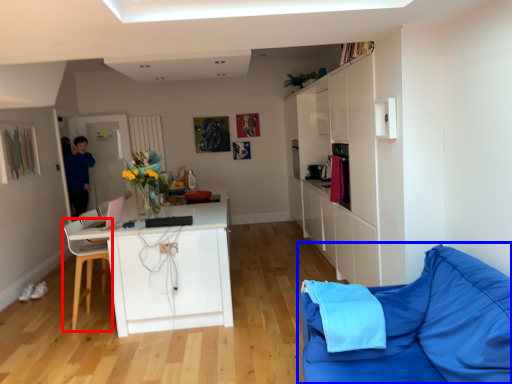
Question: Which object is closer to the camera taking this photo, chair (highlighted by a red box) or studio couch (highlighted by a blue box)?

Choices:
 (A) chair
 (B) studio couch

Answer: (B)